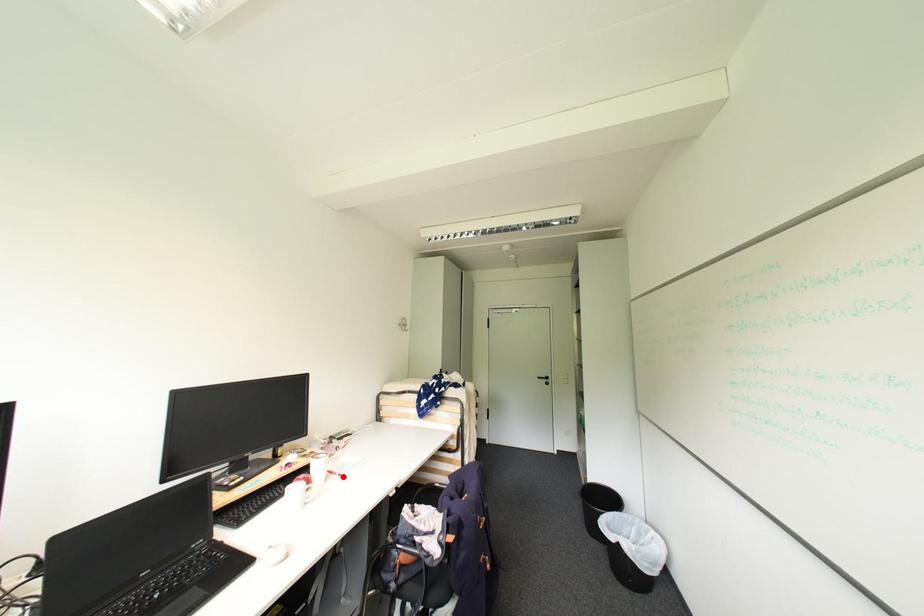
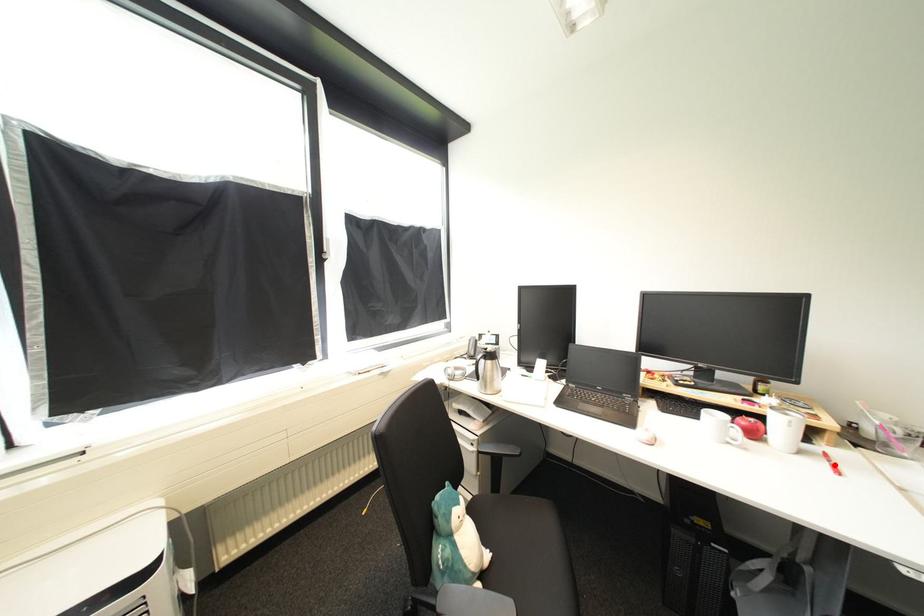
I am providing you with two images of the same scene from different viewpoints. A red point is marked on the first image and another point is marked on the second image. Do the highlighted points in image1 and image2 indicate the same real-world spot?

Yes